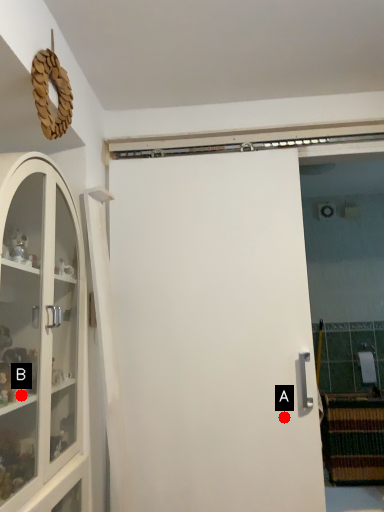
Question: Two points are circled on the image, labeled by A and B beside each circle. Which of the following is the farthest from the observer?

Choices:
 (A) A is further
 (B) B is further

Answer: (A)